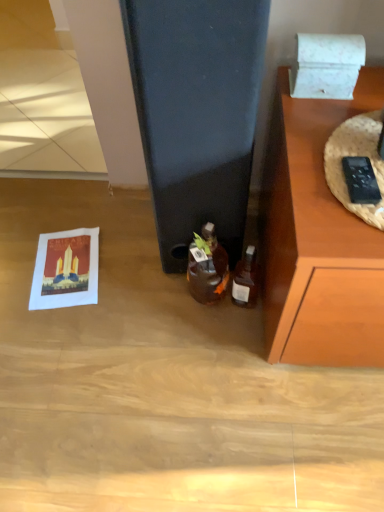
Find the location of a particular element. vacant space behind black plastic remote control at right is located at coordinates (354, 141).